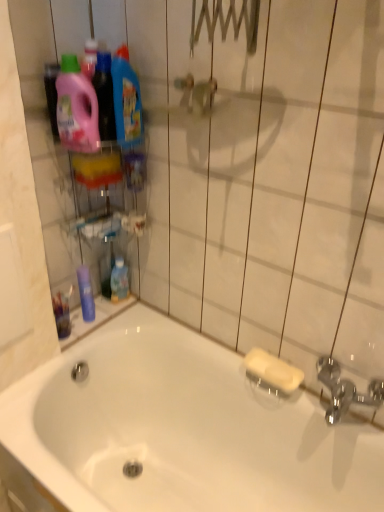
What is the approximate height of blue glossy detergent at upper left, the first cleaning product viewed from the right?

The height of blue glossy detergent at upper left, the first cleaning product viewed from the right, is 27.92 centimeters.

This screenshot has height=512, width=384. What do you see at coordinates (76, 108) in the screenshot? I see `pink plastic detergent at upper left, the second cleaning product in the right-to-left sequence` at bounding box center [76, 108].

You are a GUI agent. You are given a task and a screenshot of the screen. Output one action in this format:
    pyautogui.click(x=<x>, y=<y>)
    Task: Click on the white glossy bathtub at lower left
    This screenshot has width=384, height=512.
    Given the screenshot: What is the action you would take?
    pyautogui.click(x=181, y=430)

At what (x,y) coordinates should I click in order to perform the action: click on blue glossy detergent at upper left, the 2th cleaning product when ordered from left to right. Please return your answer as a coordinate pair (x, y). This screenshot has height=512, width=384. Looking at the image, I should click on (126, 99).

From a real-world perspective, which cleaning product is the 1st one above the blue glossy mouthwash at lower center, which is the 2th mouthwash in left-to-right order? Please provide its 2D coordinates.

[(76, 108)]

Is blue glossy mouthwash at lower center, which is the first mouthwash from right to left, oriented towards pink plastic detergent at upper left, the first cleaning product positioned from the left?

No, blue glossy mouthwash at lower center, which is the first mouthwash from right to left, is not aimed at pink plastic detergent at upper left, the first cleaning product positioned from the left.

Considering the positions of points (124, 269) and (84, 138), is point (124, 269) closer to camera compared to point (84, 138)?

That is False.

Is blue glossy mouthwash at lower center, which is the 2th mouthwash in left-to-right order, in contact with pink plastic detergent at upper left, the first cleaning product positioned from the left?

No.

Considering the points (326, 489) and (118, 280), which point is behind, point (326, 489) or point (118, 280)?

Positioned behind is point (118, 280).

Is blue glossy mouthwash at lower center, which is the 2th mouthwash in left-to-right order, a part of white glossy bathtub at lower left?

That's incorrect, blue glossy mouthwash at lower center, which is the 2th mouthwash in left-to-right order, is not inside white glossy bathtub at lower left.

Is white glossy bathtub at lower left oriented towards blue glossy mouthwash at lower center, which is the 2th mouthwash in left-to-right order?

No, white glossy bathtub at lower left is not turned towards blue glossy mouthwash at lower center, which is the 2th mouthwash in left-to-right order.

Who is shorter, white glossy bathtub at lower left or blue glossy mouthwash at lower center, which is the 2th mouthwash in left-to-right order?

Standing shorter between the two is blue glossy mouthwash at lower center, which is the 2th mouthwash in left-to-right order.

Which of these two, pink plastic detergent at upper left, the second cleaning product in the right-to-left sequence, or blue glossy mouthwash at left, which is the 1th mouthwash from left to right, stands shorter?

blue glossy mouthwash at left, which is the 1th mouthwash from left to right.

Is pink plastic detergent at upper left, the first cleaning product positioned from the left, not near blue glossy mouthwash at left, which is the 1th mouthwash from left to right?

That's not correct — pink plastic detergent at upper left, the first cleaning product positioned from the left, is a little close to blue glossy mouthwash at left, which is the 1th mouthwash from left to right.

Is pink plastic detergent at upper left, the second cleaning product in the right-to-left sequence, oriented away from blue glossy mouthwash at left, which is the 1th mouthwash from left to right?

No.

From the image's perspective, between pink plastic detergent at upper left, the second cleaning product in the right-to-left sequence, and blue glossy mouthwash at left, which appears as the 2th mouthwash when viewed from the right, who is located below?

blue glossy mouthwash at left, which appears as the 2th mouthwash when viewed from the right, is shown below in the image.

Which is correct: blue glossy mouthwash at lower center, which is the 2th mouthwash in left-to-right order, is inside blue glossy mouthwash at left, which appears as the 2th mouthwash when viewed from the right, or outside of it?

blue glossy mouthwash at lower center, which is the 2th mouthwash in left-to-right order, is not inside blue glossy mouthwash at left, which appears as the 2th mouthwash when viewed from the right, it's outside.

From the image's perspective, is blue glossy mouthwash at lower center, which is the first mouthwash from right to left, located above blue glossy mouthwash at left, which is the 1th mouthwash from left to right?

Yes, from the image's perspective, blue glossy mouthwash at lower center, which is the first mouthwash from right to left, is over blue glossy mouthwash at left, which is the 1th mouthwash from left to right.

Is blue glossy mouthwash at lower center, which is the first mouthwash from right to left, at the right side of blue glossy mouthwash at left, which is the 1th mouthwash from left to right?

Correct, you'll find blue glossy mouthwash at lower center, which is the first mouthwash from right to left, to the right of blue glossy mouthwash at left, which is the 1th mouthwash from left to right.

The image size is (384, 512). I want to click on mouthwash on the right of blue glossy mouthwash at left, which is the 1th mouthwash from left to right, so click(119, 281).

Does white glossy bathtub at lower left appear on the right side of blue glossy detergent at upper left, the first cleaning product viewed from the right?

Yes.

Which is in front, point (334, 473) or point (123, 105)?

Point (123, 105)

From the image's perspective, is white glossy bathtub at lower left located beneath blue glossy detergent at upper left, the first cleaning product viewed from the right?

Correct, white glossy bathtub at lower left appears lower than blue glossy detergent at upper left, the first cleaning product viewed from the right, in the image.

Is white glossy bathtub at lower left thinner than blue glossy detergent at upper left, the 2th cleaning product when ordered from left to right?

No.

From a real-world perspective, between blue glossy detergent at upper left, the first cleaning product viewed from the right, and white glossy bathtub at lower left, who is vertically higher?

blue glossy detergent at upper left, the first cleaning product viewed from the right, is physically above.

Is blue glossy detergent at upper left, the 2th cleaning product when ordered from left to right, bigger than white glossy bathtub at lower left?

Incorrect, blue glossy detergent at upper left, the 2th cleaning product when ordered from left to right, is not larger than white glossy bathtub at lower left.

Measure the distance between blue glossy detergent at upper left, the 2th cleaning product when ordered from left to right, and white glossy bathtub at lower left.

blue glossy detergent at upper left, the 2th cleaning product when ordered from left to right, is 36.60 inches away from white glossy bathtub at lower left.

Would you say white glossy bathtub at lower left is part of blue glossy mouthwash at left, which appears as the 2th mouthwash when viewed from the right,'s contents?

No, white glossy bathtub at lower left is not inside blue glossy mouthwash at left, which appears as the 2th mouthwash when viewed from the right.

From the picture: Which is in front, blue glossy mouthwash at left, which appears as the 2th mouthwash when viewed from the right, or white glossy bathtub at lower left?

white glossy bathtub at lower left is closer to the camera.

Which is behind, point (91, 303) or point (238, 394)?

The point (91, 303) is more distant.

Considering the sizes of objects blue glossy mouthwash at left, which appears as the 2th mouthwash when viewed from the right, and white glossy bathtub at lower left in the image provided, who is shorter, blue glossy mouthwash at left, which appears as the 2th mouthwash when viewed from the right, or white glossy bathtub at lower left?

blue glossy mouthwash at left, which appears as the 2th mouthwash when viewed from the right, is shorter.

At what (x,y) coordinates should I click in order to perform the action: click on mouthwash lying on the right of pink plastic detergent at upper left, the first cleaning product positioned from the left. Please return your answer as a coordinate pair (x, y). The width and height of the screenshot is (384, 512). Looking at the image, I should click on (119, 281).

This screenshot has height=512, width=384. I want to click on bathtub that appears below the blue glossy mouthwash at lower center, which is the 2th mouthwash in left-to-right order (from a real-world perspective), so click(x=181, y=430).

When comparing their distances from blue glossy mouthwash at lower center, which is the first mouthwash from right to left, does pink plastic detergent at upper left, the first cleaning product positioned from the left, or white glossy bathtub at lower left seem closer?

Based on the image, white glossy bathtub at lower left appears to be nearer to blue glossy mouthwash at lower center, which is the first mouthwash from right to left.

Estimate the real-world distances between objects in this image. Which object is further from white glossy bathtub at lower left, blue glossy mouthwash at left, which is the 1th mouthwash from left to right, or blue glossy detergent at upper left, the 2th cleaning product when ordered from left to right?

The object further to white glossy bathtub at lower left is blue glossy detergent at upper left, the 2th cleaning product when ordered from left to right.

Based on their spatial positions, is blue glossy detergent at upper left, the 2th cleaning product when ordered from left to right, or blue glossy mouthwash at left, which is the 1th mouthwash from left to right, closer to pink plastic detergent at upper left, the first cleaning product positioned from the left?

The object closer to pink plastic detergent at upper left, the first cleaning product positioned from the left, is blue glossy detergent at upper left, the 2th cleaning product when ordered from left to right.

Based on their spatial positions, is white glossy bathtub at lower left or blue glossy detergent at upper left, the first cleaning product viewed from the right, closer to blue glossy mouthwash at lower center, which is the first mouthwash from right to left?

white glossy bathtub at lower left lies closer to blue glossy mouthwash at lower center, which is the first mouthwash from right to left, than the other object.

Based on their spatial positions, is blue glossy detergent at upper left, the 2th cleaning product when ordered from left to right, or white glossy bathtub at lower left further from blue glossy mouthwash at left, which appears as the 2th mouthwash when viewed from the right?

Based on the image, blue glossy detergent at upper left, the 2th cleaning product when ordered from left to right, appears to be further to blue glossy mouthwash at left, which appears as the 2th mouthwash when viewed from the right.

Considering their positions, is blue glossy mouthwash at left, which appears as the 2th mouthwash when viewed from the right, positioned closer to white glossy bathtub at lower left than blue glossy mouthwash at lower center, which is the first mouthwash from right to left?

blue glossy mouthwash at left, which appears as the 2th mouthwash when viewed from the right, is closer to white glossy bathtub at lower left.

From the image, which object appears to be nearer to blue glossy mouthwash at lower center, which is the first mouthwash from right to left, white glossy bathtub at lower left or pink plastic detergent at upper left, the second cleaning product in the right-to-left sequence?

The object closer to blue glossy mouthwash at lower center, which is the first mouthwash from right to left, is white glossy bathtub at lower left.

Based on their spatial positions, is blue glossy mouthwash at left, which appears as the 2th mouthwash when viewed from the right, or blue glossy mouthwash at lower center, which is the 2th mouthwash in left-to-right order, closer to blue glossy detergent at upper left, the first cleaning product viewed from the right?

blue glossy mouthwash at lower center, which is the 2th mouthwash in left-to-right order, is positioned closer to the anchor blue glossy detergent at upper left, the first cleaning product viewed from the right.

Identify the location of cleaning product between blue glossy detergent at upper left, the 2th cleaning product when ordered from left to right, and white glossy bathtub at lower left, in the vertical direction. (76, 108).

The image size is (384, 512). What are the coordinates of `cleaning product between blue glossy detergent at upper left, the first cleaning product viewed from the right, and blue glossy mouthwash at left, which appears as the 2th mouthwash when viewed from the right, in the up-down direction` in the screenshot? It's located at (76, 108).

Locate an element on the screen. cleaning product between blue glossy detergent at upper left, the first cleaning product viewed from the right, and blue glossy mouthwash at lower center, which is the first mouthwash from right to left, from top to bottom is located at coordinates (76, 108).

At what (x,y) coordinates should I click in order to perform the action: click on mouthwash positioned between white glossy bathtub at lower left and blue glossy mouthwash at lower center, which is the first mouthwash from right to left, from near to far. Please return your answer as a coordinate pair (x, y). Looking at the image, I should click on (86, 294).